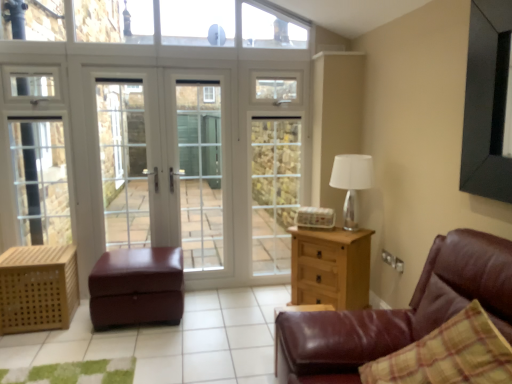
Locate an element on the screen. Image resolution: width=512 pixels, height=384 pixels. vacant area on top of white glass door at center (from a real-world perspective) is located at coordinates (153, 52).